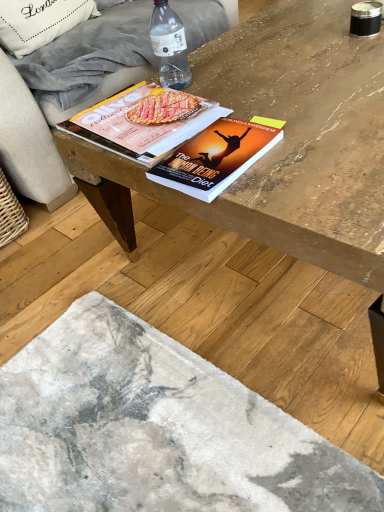
Where is `free location to the right of matte paper magazine at center, marked as the first book in a back-to-front arrangement`? free location to the right of matte paper magazine at center, marked as the first book in a back-to-front arrangement is located at coordinates 261,90.